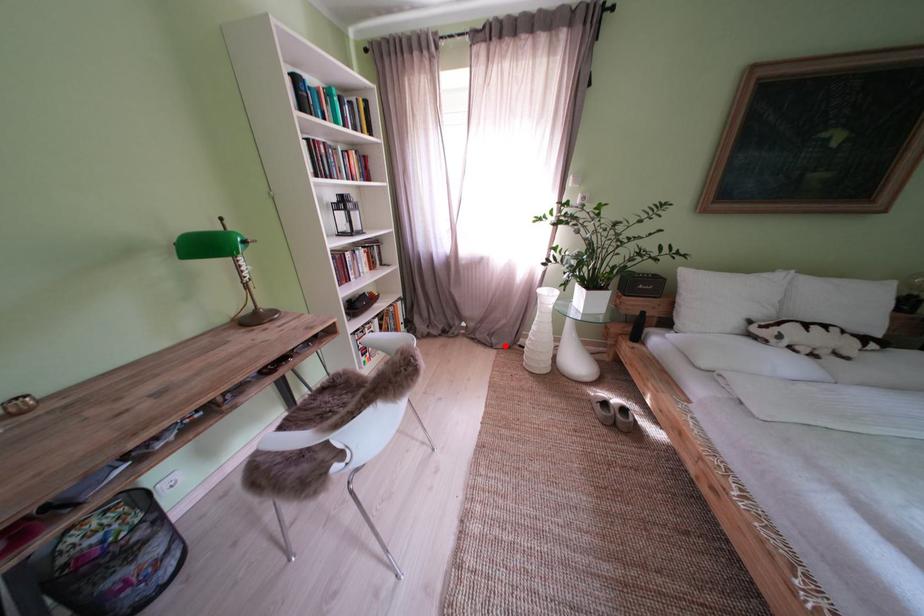
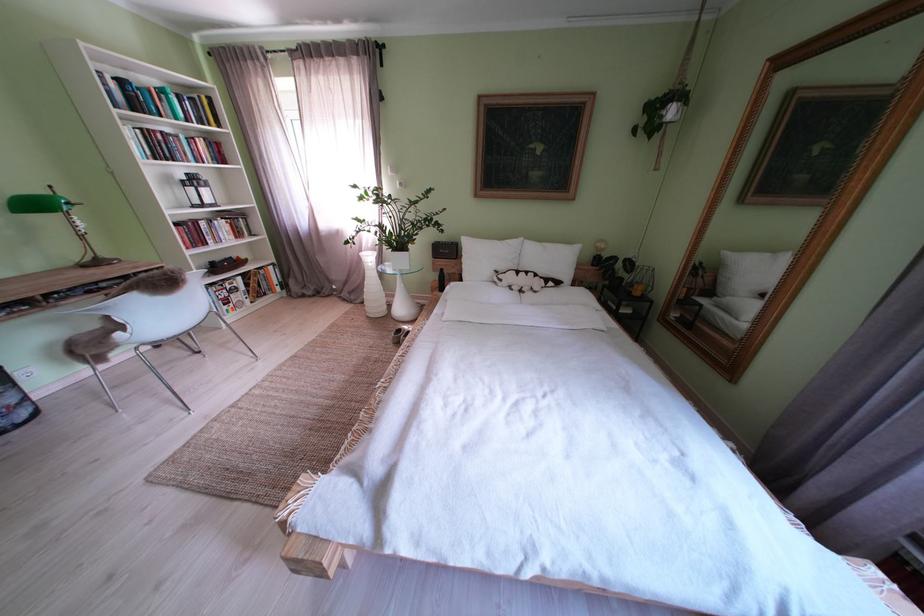
Question: I am providing you with two images of the same scene from different viewpoints. In image1, a red point is highlighted. Considering the same 3D point in image2, which of the following is correct?

Choices:
 (A) It is closer
 (B) It is farther

Answer: (B)